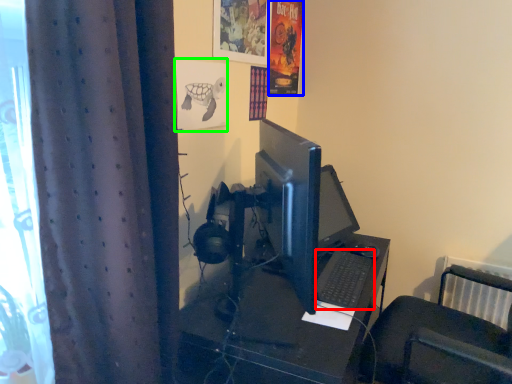
Question: Which is farther away from computer keyboard (highlighted by a red box)? poster page (highlighted by a blue box) or poster page (highlighted by a green box)?

Choices:
 (A) poster page
 (B) poster page

Answer: (A)